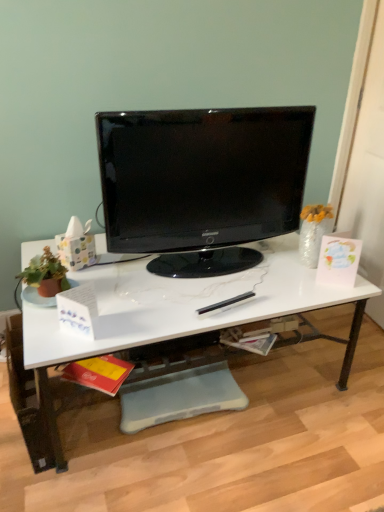
Question: From a real-world perspective, is white marble desk at center above or below black glossy monitor at center?

Choices:
 (A) above
 (B) below

Answer: (B)

Question: Considering the relative positions of white marble desk at center and black glossy monitor at center in the image provided, is white marble desk at center to the left or to the right of black glossy monitor at center?

Choices:
 (A) left
 (B) right

Answer: (A)

Question: Considering the positions of white marble desk at center and black glossy monitor at center in the image, is white marble desk at center taller or shorter than black glossy monitor at center?

Choices:
 (A) tall
 (B) short

Answer: (B)

Question: From a real-world perspective, is black glossy monitor at center positioned above or below white marble desk at center?

Choices:
 (A) below
 (B) above

Answer: (B)

Question: From the image's perspective, is black glossy monitor at center positioned above or below white marble desk at center?

Choices:
 (A) above
 (B) below

Answer: (A)

Question: Considering their positions, is black glossy monitor at center located in front of or behind white marble desk at center?

Choices:
 (A) behind
 (B) front

Answer: (A)

Question: Considering the relative positions of black glossy monitor at center and white marble desk at center in the image provided, is black glossy monitor at center to the left or to the right of white marble desk at center?

Choices:
 (A) left
 (B) right

Answer: (B)